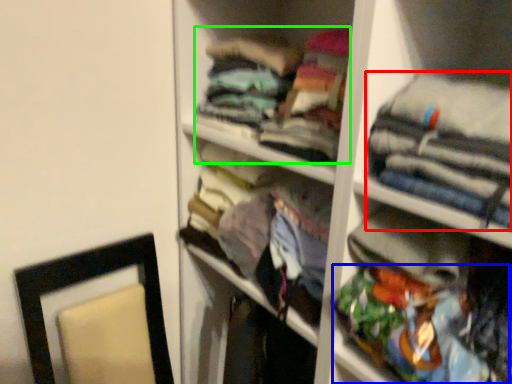
Question: Estimate the real-world distances between objects in this image. Which object is closer to clothing (highlighted by a red box), clothing (highlighted by a blue box) or clothing (highlighted by a green box)?

Choices:
 (A) clothing
 (B) clothing

Answer: (A)